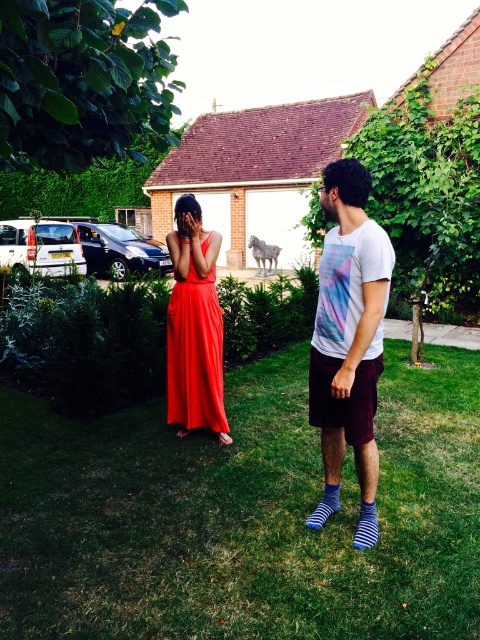
From the picture: Which is above, white tie-dye t-shirt at center or shiny satin dress at center?

Positioned higher is shiny satin dress at center.

Measure the distance between point (342, 397) and camera.

They are 3.35 meters apart.

This screenshot has width=480, height=640. In order to click on white tie-dye t-shirt at center in this screenshot , I will do `click(348, 340)`.

Does matte red dress at center have a greater width compared to white tie-dye t-shirt at center?

Indeed, matte red dress at center has a greater width compared to white tie-dye t-shirt at center.

Between matte red dress at center and white tie-dye t-shirt at center, which one has less height?

matte red dress at center is shorter.

Does point (312, 339) lie in front of point (317, 512)?

That is True.

I want to click on matte red dress at center, so click(x=348, y=340).

Is point (432, 438) closer to viewer compared to point (361, 417)?

No.

How distant is green grass at center from matte red dress at center?

They are 1.00 meters apart.

Is point (276, 456) positioned before point (364, 371)?

No, (276, 456) is behind (364, 371).

Find the location of a particular element. This screenshot has height=640, width=480. green grass at center is located at coordinates (243, 515).